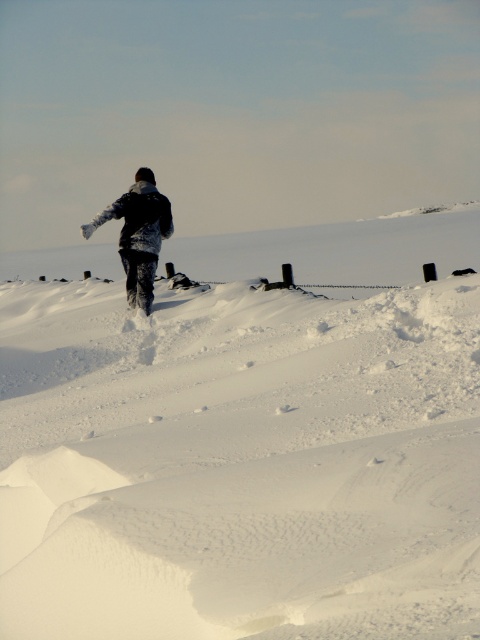
Describe the element at coordinates (243, 440) in the screenshot. This screenshot has height=640, width=480. I see `white fluffy snow at center` at that location.

Which is behind, point (115, 408) or point (141, 304)?

The point (141, 304) is more distant.

Does point (60, 380) come in front of point (153, 243)?

Yes, it is in front of point (153, 243).

Image resolution: width=480 pixels, height=640 pixels. I want to click on white fluffy snow at center, so click(243, 440).